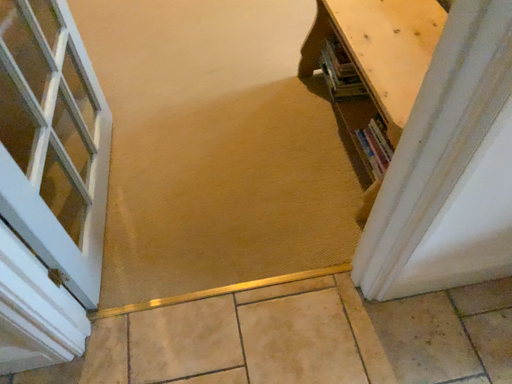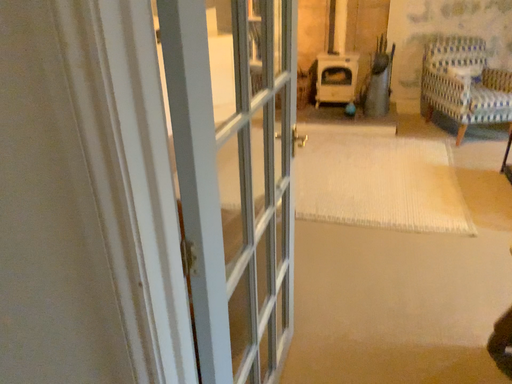
Question: How did the camera likely rotate when shooting the video?

Choices:
 (A) rotated upward
 (B) rotated downward

Answer: (A)